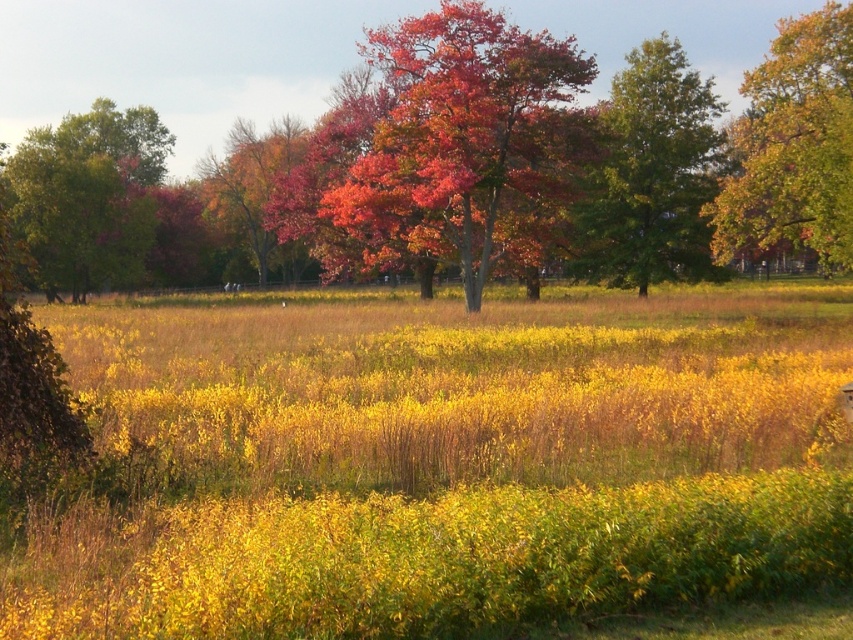
Question: Which object is positioned farthest from the shiny orange tree at center?

Choices:
 (A) shiny red leaves at center
 (B) green leafy tree at center
 (C) golden yellow leaves at upper right
 (D) green leafy tree at left

Answer: (A)

Question: Is shiny red leaves at center smaller than golden yellow leaves at upper right?

Choices:
 (A) no
 (B) yes

Answer: (A)

Question: From the image, what is the correct spatial relationship of golden yellow leaves at upper right in relation to shiny orange tree at center?

Choices:
 (A) below
 (B) above

Answer: (A)

Question: Which point is farther to the camera?

Choices:
 (A) (605, 225)
 (B) (828, 205)
 (C) (236, 68)
 (D) (51, 205)

Answer: (C)

Question: Which object is the farthest from the green leafy tree at left?

Choices:
 (A) green leafy tree at center
 (B) shiny orange tree at center
 (C) golden yellow leaves at upper right

Answer: (C)

Question: Is green leafy tree at center bigger than green leafy tree at left?

Choices:
 (A) no
 (B) yes

Answer: (A)